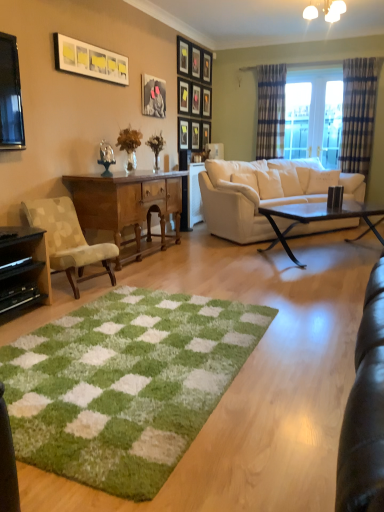
Question: Is wooden picture frame at center, the 8th picture frame in the front-to-back sequence, to the left or to the right of matte black picture frame at upper center, the seventh picture frame in the front-to-back sequence, in the image?

Choices:
 (A) right
 (B) left

Answer: (B)

Question: From their relative heights in the image, would you say wooden picture frame at center, positioned as the fourth picture frame in back-to-front order, is taller or shorter than matte black picture frame at upper center, which is counted as the fifth picture frame, starting from the back?

Choices:
 (A) short
 (B) tall

Answer: (B)

Question: Which is farther from the plaid fabric curtain at right, the first curtain positioned from the left?

Choices:
 (A) green shaggy rug at center
 (B) matte black picture frame at upper center, the 9th picture frame when ordered from front to back
 (C) translucent glass vase at center, the second houseplant when ordered from back to front
 (D) translucent glass vase at center, the second houseplant positioned from the left
 (E) wooden picture frame at upper center, which appears as the 11th picture frame when viewed from the front

Answer: (A)

Question: Which is farther from the matte black picture frame at upper center, the 10th picture frame when ordered from back to front?

Choices:
 (A) wooden picture frame at upper center, which appears as the 11th picture frame when viewed from the front
 (B) translucent glass vase at center, the 1th houseplant when ordered from right to left
 (C) matte black picture frame at upper center, the 7th picture frame viewed from the back
 (D) plaid fabric curtain at right, the first curtain in the right-to-left sequence
 (E) plaid fabric curtain at right, the 2th curtain when ordered from right to left

Answer: (D)